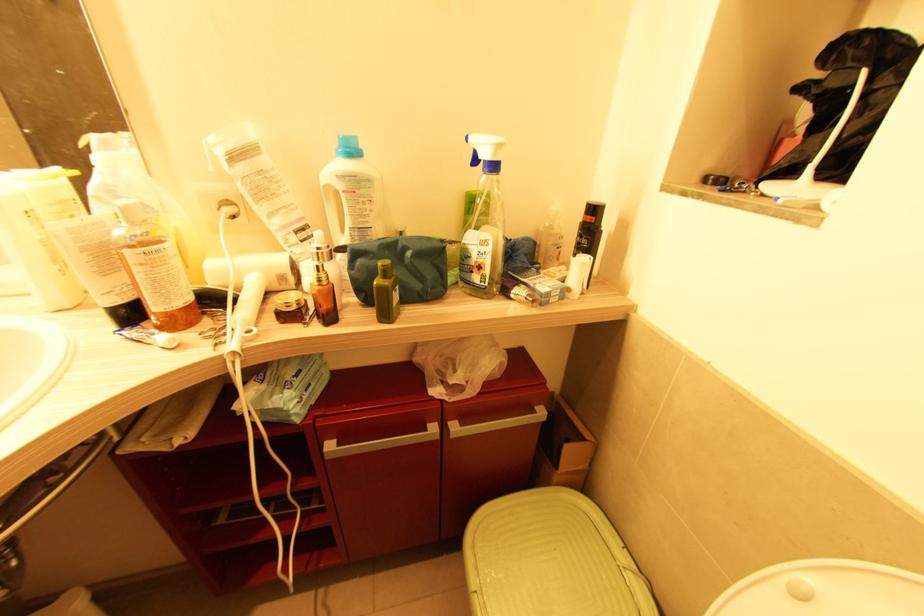
Describe the element at coordinates (334, 209) in the screenshot. I see `a white bottle handle` at that location.